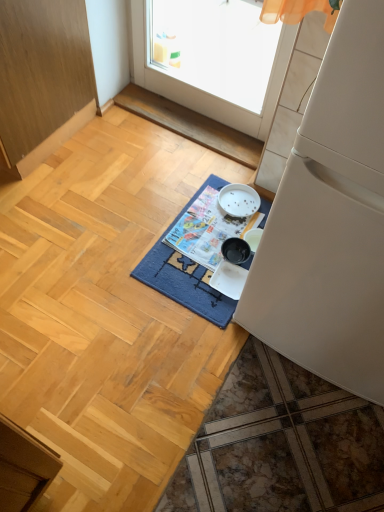
I want to click on blank space to the left of white matte refrigerator at right, so click(x=164, y=296).